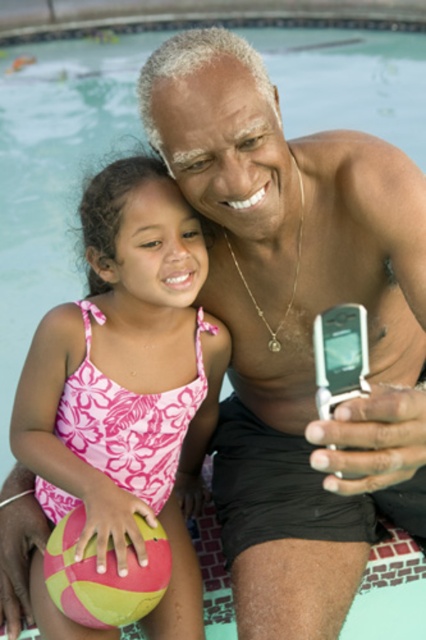
Question: Is pink floral swimsuit at center to the left of multicolored rubber ball at lower left from the viewer's perspective?

Choices:
 (A) yes
 (B) no

Answer: (B)

Question: Is pink floral swimsuit at center bigger than multicolored rubber ball at lower left?

Choices:
 (A) yes
 (B) no

Answer: (A)

Question: Which point is farther to the camera?

Choices:
 (A) (69, 541)
 (B) (71, 326)

Answer: (B)

Question: Does pink floral swimsuit at center appear over multicolored rubber ball at lower left?

Choices:
 (A) no
 (B) yes

Answer: (B)

Question: Which point is farther to the camera?

Choices:
 (A) (101, 593)
 (B) (141, 262)

Answer: (B)